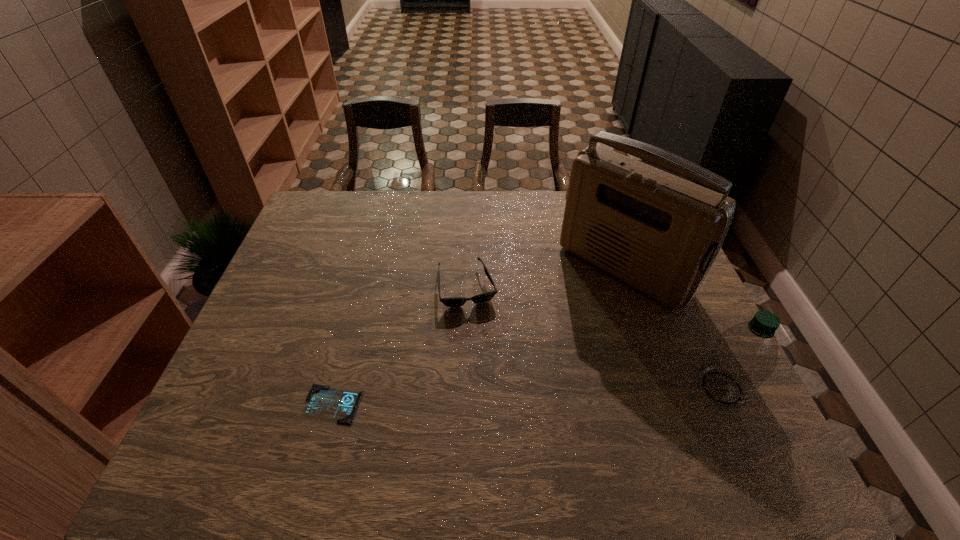
Locate an element on the screen. This screenshot has height=540, width=960. object present at the near right corner is located at coordinates (743, 356).

You are a GUI agent. You are given a task and a screenshot of the screen. Output one action in this format:
    pyautogui.click(x=<x>, y=<y>)
    Task: Click on the free space at the far edge of the desktop
    The image size is (960, 540).
    Given the screenshot: What is the action you would take?
    pyautogui.click(x=484, y=192)

In the image, there is a desktop. What are the coordinates of `free space at the near edge` in the screenshot? It's located at (659, 410).

Where is `free space at the left edge of the desktop`? The height and width of the screenshot is (540, 960). free space at the left edge of the desktop is located at coordinates (293, 320).

The height and width of the screenshot is (540, 960). Identify the location of free space at the far left corner of the desktop. (317, 225).

Where is `vacant area at the near left corner of the desktop`? This screenshot has height=540, width=960. vacant area at the near left corner of the desktop is located at coordinates [276, 417].

Where is `empty space that is in between the tallest object and the second tallest object`? The height and width of the screenshot is (540, 960). empty space that is in between the tallest object and the second tallest object is located at coordinates (672, 328).

Where is `free area in between the sunglasses and the leftmost object`? This screenshot has height=540, width=960. free area in between the sunglasses and the leftmost object is located at coordinates (400, 346).

The width and height of the screenshot is (960, 540). Find the location of `empty location between the tallest object and the water bottle`. empty location between the tallest object and the water bottle is located at coordinates (672, 328).

Find the location of a particular element. This screenshot has height=540, width=960. vacant space that is in between the shortest object and the radio receiver is located at coordinates (478, 336).